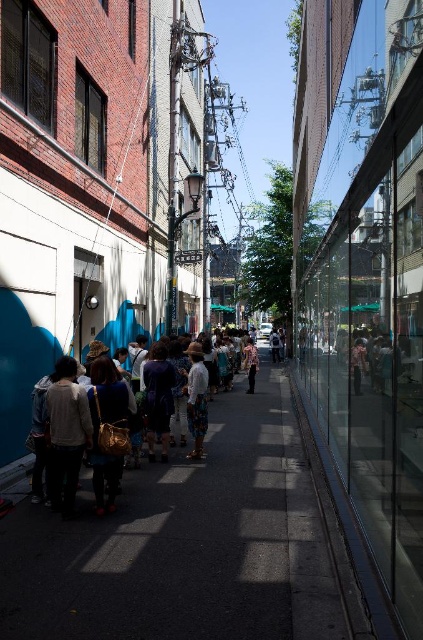
Question: Which point is farther to the camera?

Choices:
 (A) 162,390
 (B) 139,218

Answer: (B)

Question: Which object is farther from the camera taking this photo?

Choices:
 (A) matte gold bag at center
 (B) dark gray concrete sidewalk at center

Answer: (A)

Question: Can you confirm if light beige fabric bag at center is positioned to the right of matte gold bag at center?

Choices:
 (A) no
 (B) yes

Answer: (A)

Question: Can you confirm if dark gray concrete sidewalk at center is wider than white cotton shirt at center?

Choices:
 (A) yes
 (B) no

Answer: (A)

Question: Which object appears farthest from the camera in this image?

Choices:
 (A) metallic wire at upper left
 (B) floral-patterned pants at center
 (C) dark gray concrete sidewalk at center

Answer: (A)

Question: Does metallic wire at upper left appear on the left side of light beige fabric bag at center?

Choices:
 (A) no
 (B) yes

Answer: (B)